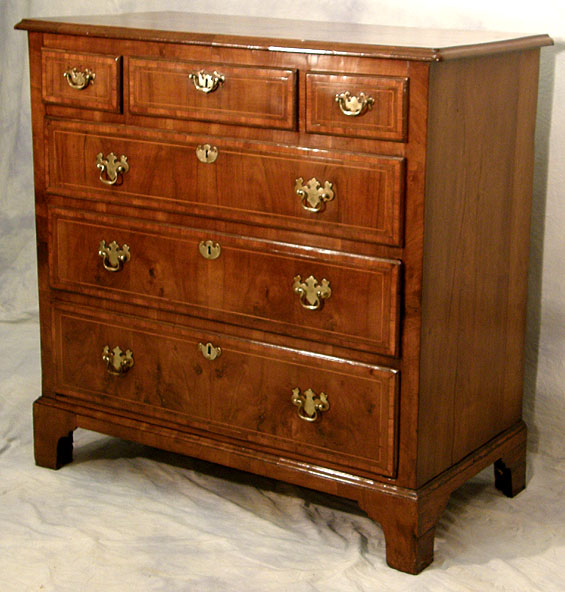
Identify the location of floor. The width and height of the screenshot is (565, 592). (277, 518).